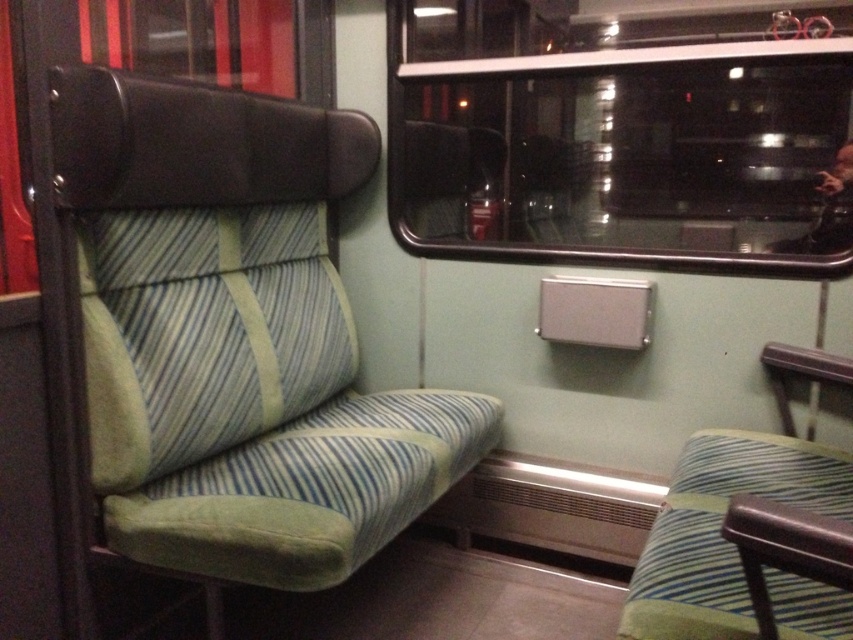
Can you confirm if green fabric seat at left is bigger than metallic silver coach at upper right?

Yes, green fabric seat at left is bigger than metallic silver coach at upper right.

Is point (234, 273) positioned behind point (822, 248)?

Yes, point (234, 273) is behind point (822, 248).

The height and width of the screenshot is (640, 853). I want to click on green fabric seat at left, so click(225, 340).

Between transparent glass window at upper center and metallic silver coach at upper right, which one is positioned lower?

metallic silver coach at upper right is lower down.

Consider the image. Can you confirm if transparent glass window at upper center is smaller than metallic silver coach at upper right?

Actually, transparent glass window at upper center might be larger than metallic silver coach at upper right.

Between point (846, 72) and point (840, 173), which one is positioned in front?

Point (846, 72)

Find the location of a particular element. transparent glass window at upper center is located at coordinates (622, 134).

Measure the distance between green fabric seat at left and transparent glass window at upper center.

green fabric seat at left and transparent glass window at upper center are 26.56 inches apart from each other.

Between green fabric seat at left and transparent glass window at upper center, which one has more height?

green fabric seat at left

The height and width of the screenshot is (640, 853). Find the location of `green fabric seat at left`. green fabric seat at left is located at coordinates (225, 340).

Where is `green fabric seat at left`? The width and height of the screenshot is (853, 640). green fabric seat at left is located at coordinates (225, 340).